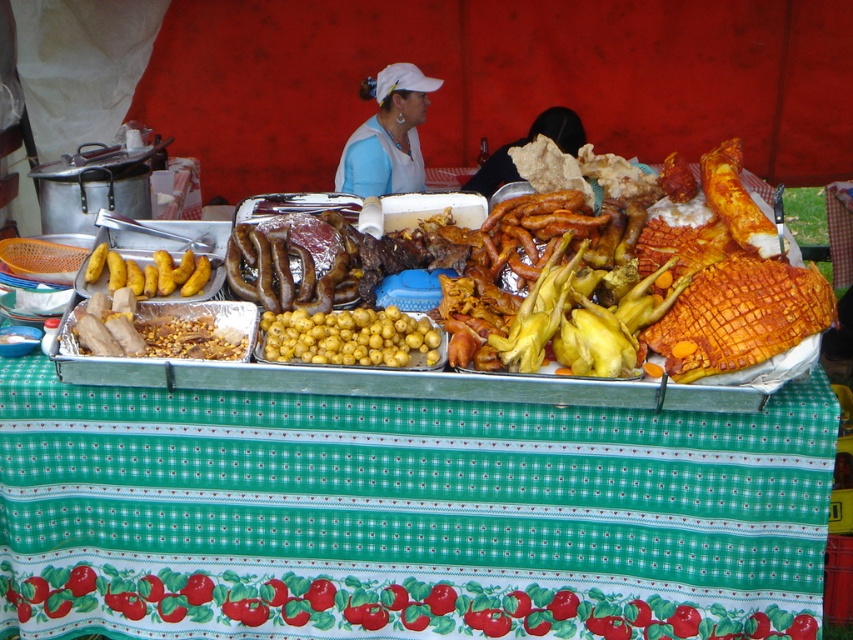
Question: Which object is farther from the camera taking this photo?

Choices:
 (A) yellow matte potatoes at left
 (B) white fabric at center

Answer: (B)

Question: Does green glossy tomato at lower center have a larger size compared to yellow matte potatoes at center?

Choices:
 (A) no
 (B) yes

Answer: (B)

Question: Among these objects, which one is nearest to the camera?

Choices:
 (A) yellow matte potatoes at left
 (B) white fabric at center
 (C) black fabric at upper center

Answer: (A)

Question: Which point is closer to the camera?

Choices:
 (A) yellow matte potatoes at center
 (B) black fabric at upper center
 (C) yellow matte potatoes at left

Answer: (A)

Question: Can you confirm if green glossy tomato at lower center is positioned to the right of white fabric at center?

Choices:
 (A) yes
 (B) no

Answer: (A)

Question: Is green glossy tomato at lower center thinner than black fabric at upper center?

Choices:
 (A) no
 (B) yes

Answer: (A)